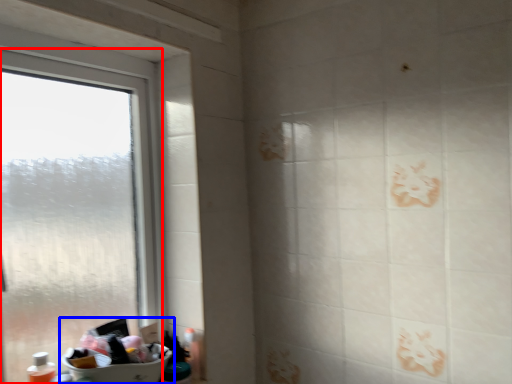
Question: Among these objects, which one is nearest to the camera, window (highlighted by a red box) or sink (highlighted by a blue box)?

Choices:
 (A) window
 (B) sink

Answer: (A)